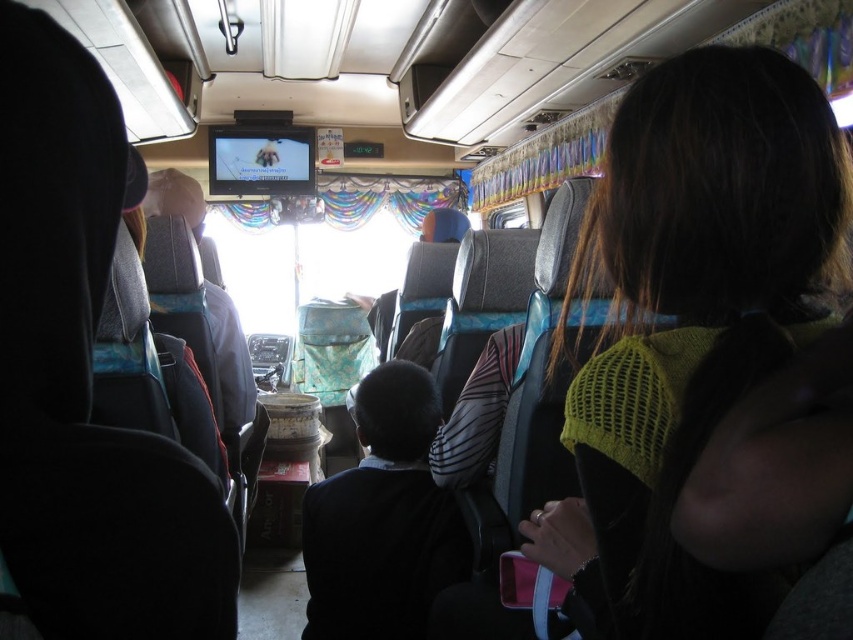
You are a passenger on a bus and want to put your backpack on the overhead compartment. You notice a knitted yellow sweater at right and a dark blue fabric at center. Which item is closer to the overhead compartments?

The knitted yellow sweater at right is above the dark blue fabric at center, so it is closer to the overhead compartments.

You are a passenger on the bus and you see a point at coordinate [689,324]. Which object is this point located on?

The point at coordinate [689,324] is located on the knitted yellow sweater at right.